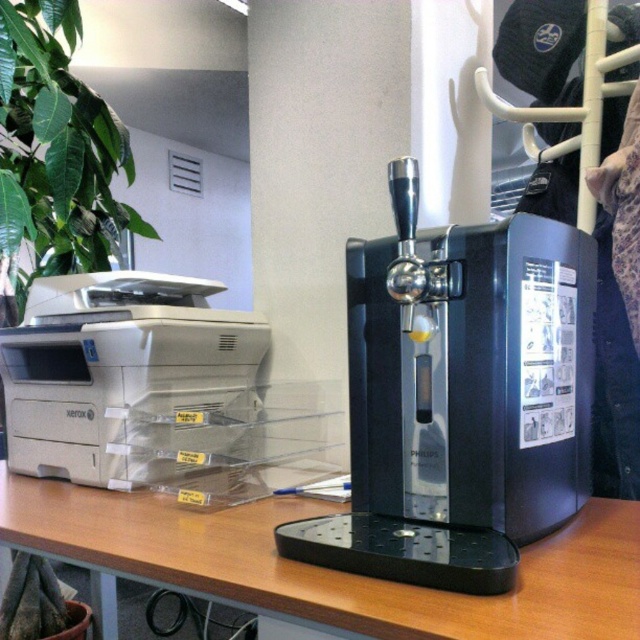
You are organizing items on the desk and need to place a new item between the brown wood table at center and the matte gray printer at left. Is there enough space between them to fit a standard notebook?

The brown wood table at center is to the right of the matte gray printer at left, so there is space between them. A standard notebook can easily fit in that space.

You are organizing the workspace and need to place a new lamp on the brown wood table at center. However, there is a matte gray printer at left currently occupying part of the table. Is the printer blocking the table space where you want to place the lamp?

The brown wood table at center is positioned under the matte gray printer at left, meaning the printer is above the table. Since the table is under the printer, the printer might be hanging above the table and not directly occupying its surface, so placing the lamp on the table should be possible without obstruction from the printer.